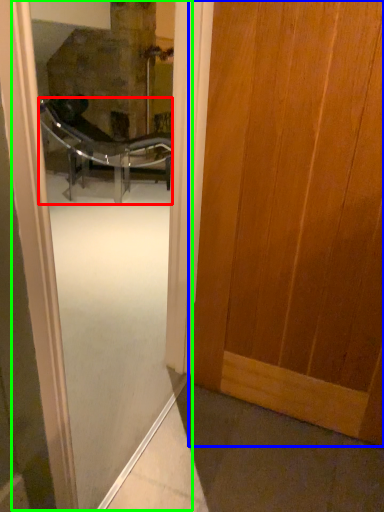
Question: Which is farther away from chair (highlighted by a red box)? door (highlighted by a blue box) or screen door (highlighted by a green box)?

Choices:
 (A) door
 (B) screen door

Answer: (A)